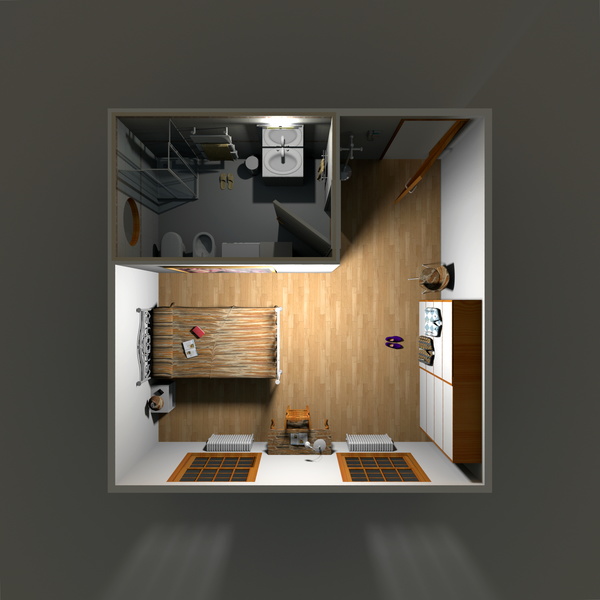
In order to click on door in this screenshot , I will do `click(417, 167)`, `click(434, 157)`, `click(407, 122)`.